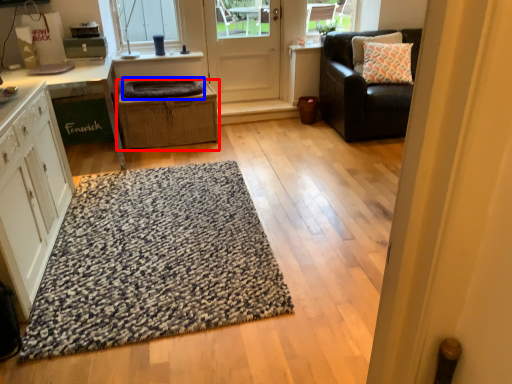
Question: Which of the following is the closest to the observer, crate (highlighted by a red box) or blanket (highlighted by a blue box)?

Choices:
 (A) crate
 (B) blanket

Answer: (A)